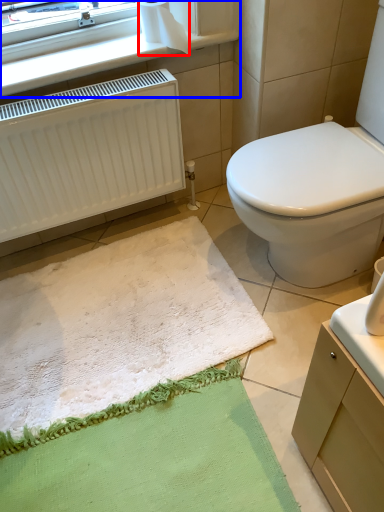
Question: Which object is closer to the camera taking this photo, toilet paper (highlighted by a red box) or window frame (highlighted by a blue box)?

Choices:
 (A) toilet paper
 (B) window frame

Answer: (B)